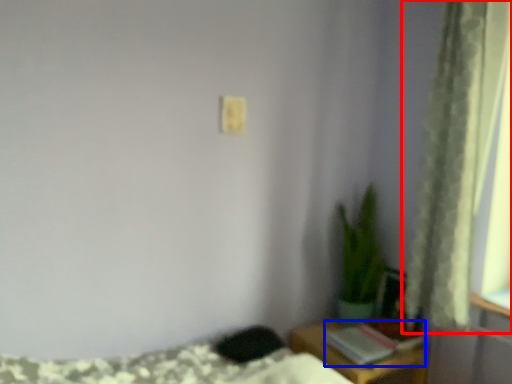
Question: Which object appears closest to the camera in this image, curtain (highlighted by a red box) or book (highlighted by a blue box)?

Choices:
 (A) curtain
 (B) book

Answer: (A)